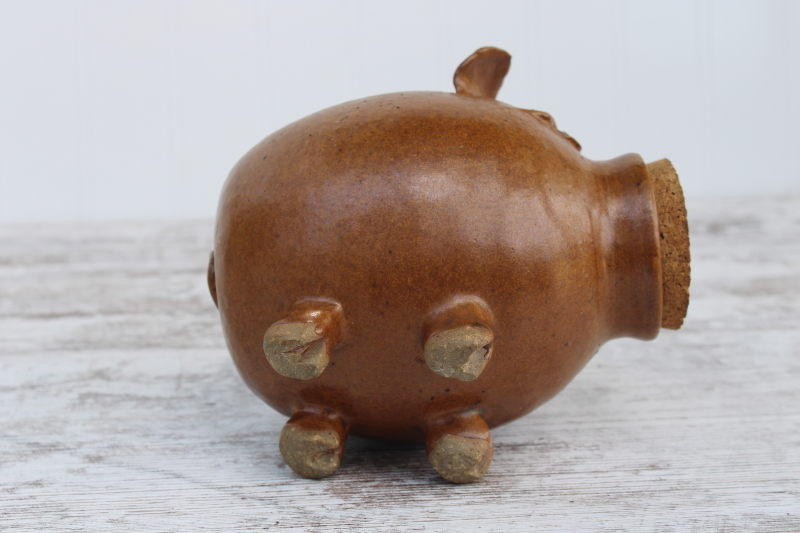
Find the location of a particular element. The width and height of the screenshot is (800, 533). the left front leg is located at coordinates (470, 466).